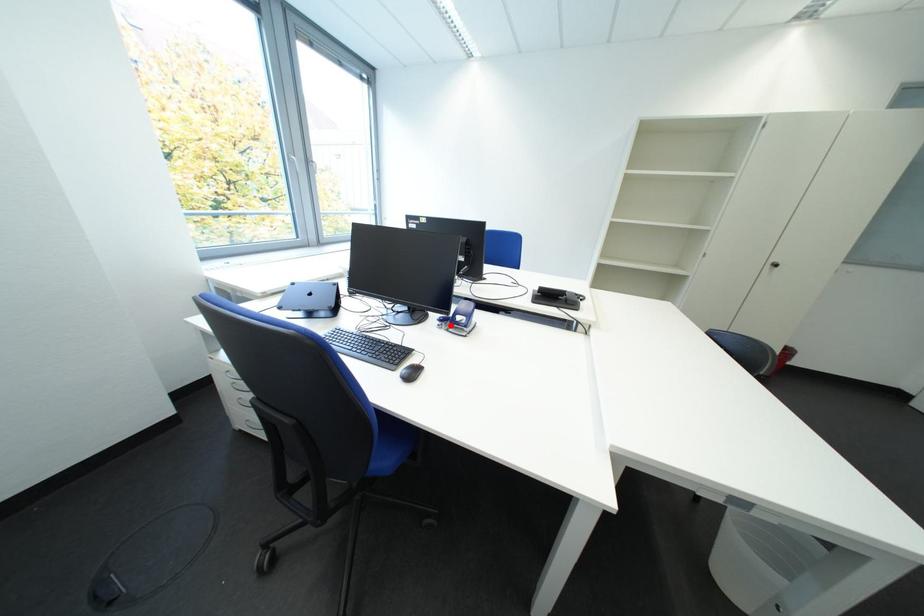
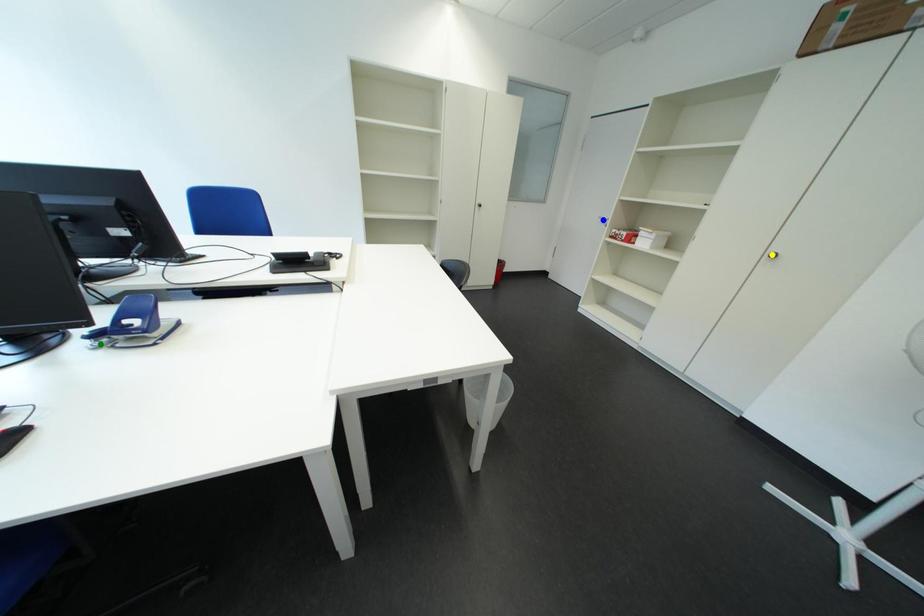
Question: I am providing you with two images of the same scene from different viewpoints. A red point is marked on the first image. You are given multiple points on the second image. Which point in image 2 represents the same 3d spot as the red point in image 1?

Choices:
 (A) green point
 (B) blue point
 (C) yellow point

Answer: (A)